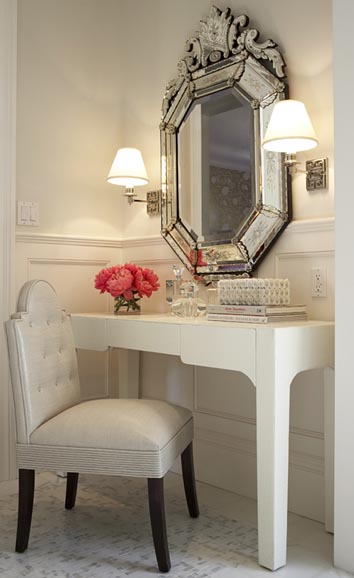
This screenshot has width=354, height=578. What are the coordinates of `lights` in the screenshot? It's located at (129, 163), (276, 129).